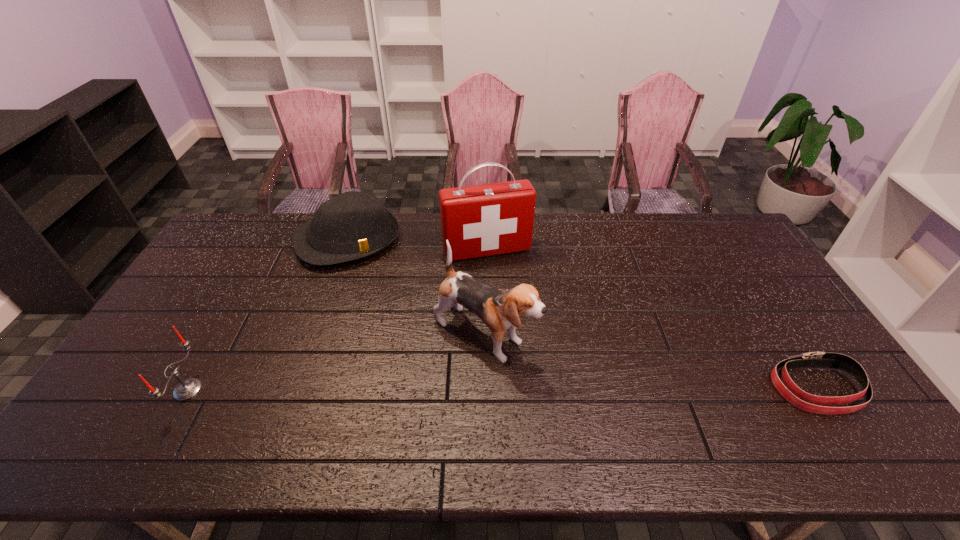
Where is `vacant space on the desktop that is between the candle and the rightmost object and is positioned on the front face of the first-aid kit`? The image size is (960, 540). vacant space on the desktop that is between the candle and the rightmost object and is positioned on the front face of the first-aid kit is located at coordinates tap(538, 389).

Where is `vacant space on the desktop that is between the leftmost object and the rightmost object and is positioned on the front-facing side of the second object from left to right`? vacant space on the desktop that is between the leftmost object and the rightmost object and is positioned on the front-facing side of the second object from left to right is located at coordinates (430, 389).

Locate an element on the screen. The width and height of the screenshot is (960, 540). free space on the desktop that is between the leftmost object and the shortest object and is positioned at the face of the puppy is located at coordinates (578, 389).